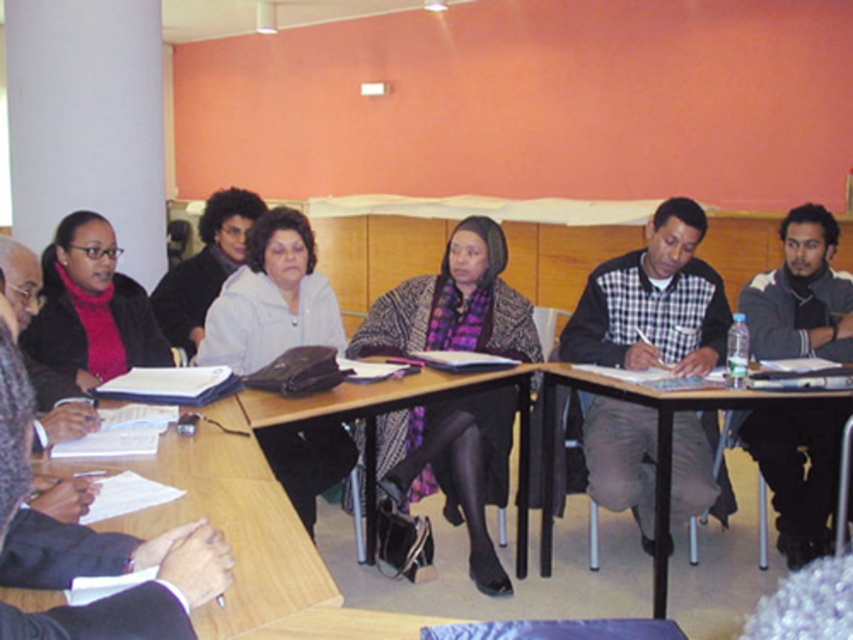
Can you confirm if dark gray sweater at right is thinner than metallic gray table at center?

Indeed, dark gray sweater at right has a lesser width compared to metallic gray table at center.

Between dark gray sweater at right and metallic gray table at center, which one appears on the left side from the viewer's perspective?

metallic gray table at center is more to the left.

This screenshot has width=853, height=640. I want to click on dark gray sweater at right, so click(801, 294).

Does dark gray sweater at right have a greater width compared to matte black jacket at left?

Yes, dark gray sweater at right is wider than matte black jacket at left.

Image resolution: width=853 pixels, height=640 pixels. What do you see at coordinates (801, 294) in the screenshot? I see `dark gray sweater at right` at bounding box center [801, 294].

What do you see at coordinates (801, 294) in the screenshot? The height and width of the screenshot is (640, 853). I see `dark gray sweater at right` at bounding box center [801, 294].

You are a GUI agent. You are given a task and a screenshot of the screen. Output one action in this format:
    pyautogui.click(x=<x>, y=<y>)
    Task: Click on the dark gray sweater at right
    The image size is (853, 640).
    Given the screenshot: What is the action you would take?
    pyautogui.click(x=801, y=294)

Who is more forward, (680, 326) or (293, 304)?

Positioned in front is point (293, 304).

Is checkered fabric shirt at center to the left of white matte jacket at center from the viewer's perspective?

No, checkered fabric shirt at center is not to the left of white matte jacket at center.

Locate an element on the screen. The image size is (853, 640). checkered fabric shirt at center is located at coordinates (653, 301).